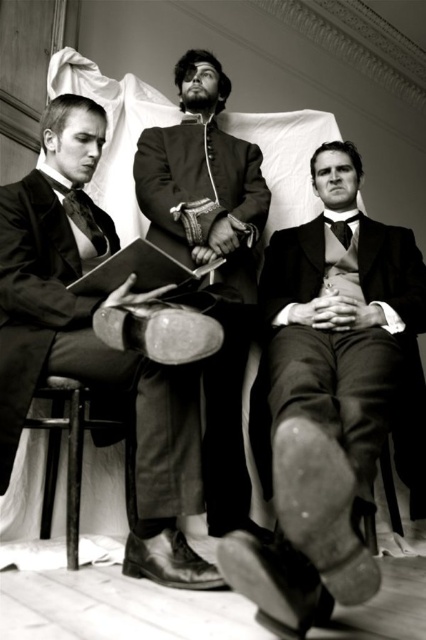
Question: Which point is farther from the camera taking this photo?

Choices:
 (A) (80, 401)
 (B) (229, 300)
 (C) (328, 225)

Answer: (C)

Question: Does wooden stool at lower left appear on the right side of matte black tie at center?

Choices:
 (A) no
 (B) yes

Answer: (B)

Question: Which object is positioned closest to the wooden stool at lower left?

Choices:
 (A) smooth black fabric suit at center
 (B) matte black tie at center

Answer: (A)

Question: Which point is farther from the camera taking this photo?

Choices:
 (A) (348, 220)
 (B) (62, 182)
 (C) (172, 536)

Answer: (A)

Question: Does smooth black fabric suit at center appear on the right side of matte black tie at center?

Choices:
 (A) no
 (B) yes

Answer: (B)

Question: Is smooth black suit at center below smooth black fabric suit at center?

Choices:
 (A) no
 (B) yes

Answer: (B)